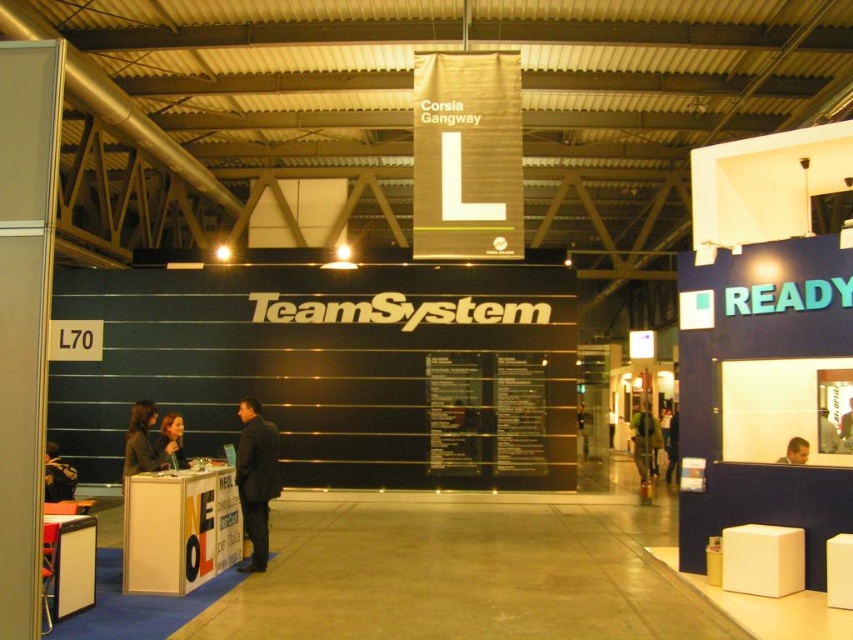
Can you confirm if black suit at center is taller than green fabric jacket at center?

Correct, black suit at center is much taller as green fabric jacket at center.

Can you confirm if black suit at center is positioned above green fabric jacket at center?

Yes, black suit at center is above green fabric jacket at center.

This screenshot has width=853, height=640. I want to click on black suit at center, so click(256, 477).

Is point (143, 436) positioned behind point (48, 458)?

No.

Image resolution: width=853 pixels, height=640 pixels. I want to click on dark brown leather jacket at left, so pos(140,442).

Is green fabric jacket at center bigger than dark brown leather jacket at center?

Incorrect, green fabric jacket at center is not larger than dark brown leather jacket at center.

Does green fabric jacket at center have a greater width compared to dark brown leather jacket at center?

No.

Which is behind, point (653, 433) or point (73, 497)?

The point (653, 433) is more distant.

This screenshot has width=853, height=640. Find the location of `green fabric jacket at center`. green fabric jacket at center is located at coordinates (645, 442).